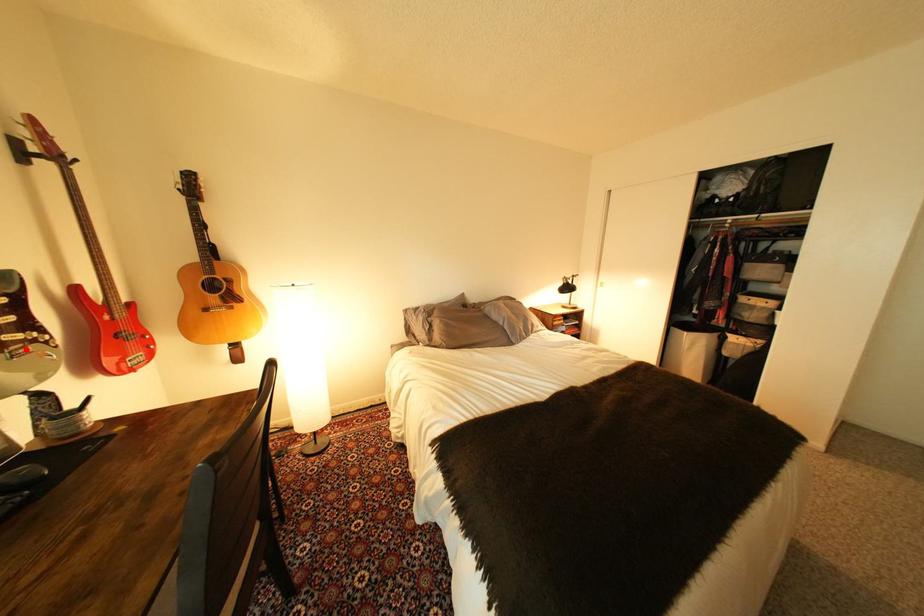
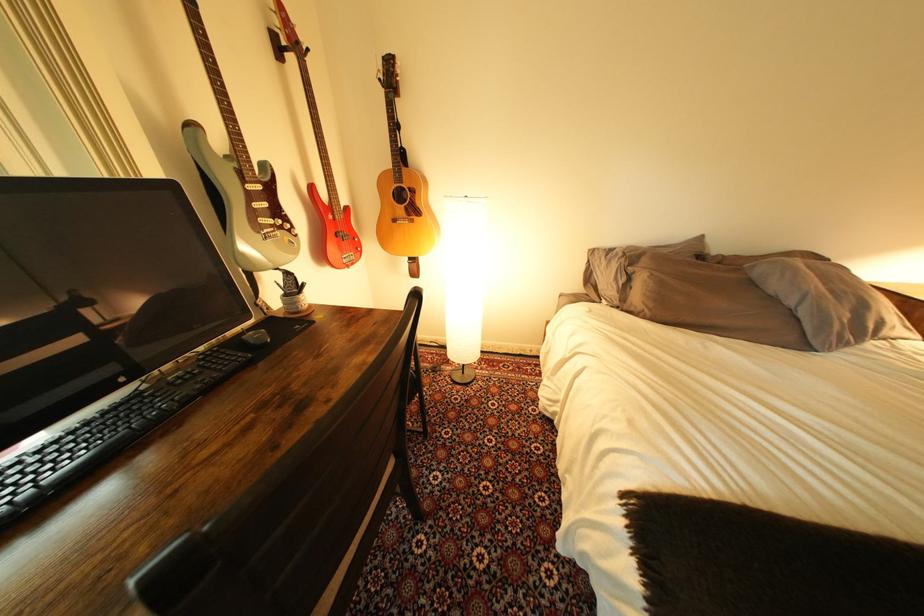
Question: A red point is marked in image1. In image2, is the corresponding 3D point closer to the camera or farther? Reply with the corresponding letter.

Choices:
 (A) The corresponding 3D point is closer.
 (B) The corresponding 3D point is farther.

Answer: (A)